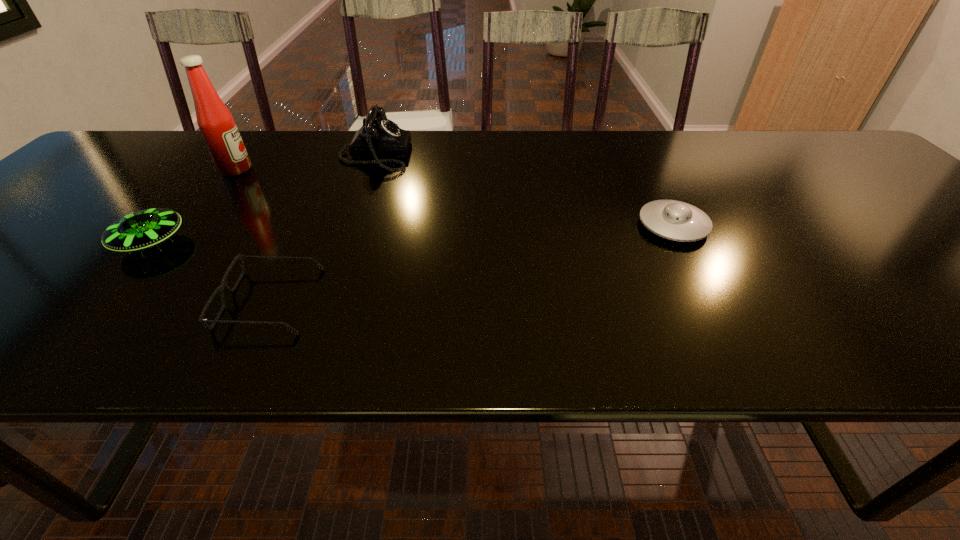
Where is `blank area in the image that satisfies the following two spatial constraints: 1. on the front-facing side of the nearest object; 2. on the front-facing side of the condiment`? The height and width of the screenshot is (540, 960). blank area in the image that satisfies the following two spatial constraints: 1. on the front-facing side of the nearest object; 2. on the front-facing side of the condiment is located at coordinates 333,170.

Find the location of a particular element. The image size is (960, 540). free location that satisfies the following two spatial constraints: 1. on the front-facing side of the nearest object; 2. on the front-facing side of the condiment is located at coordinates (333, 170).